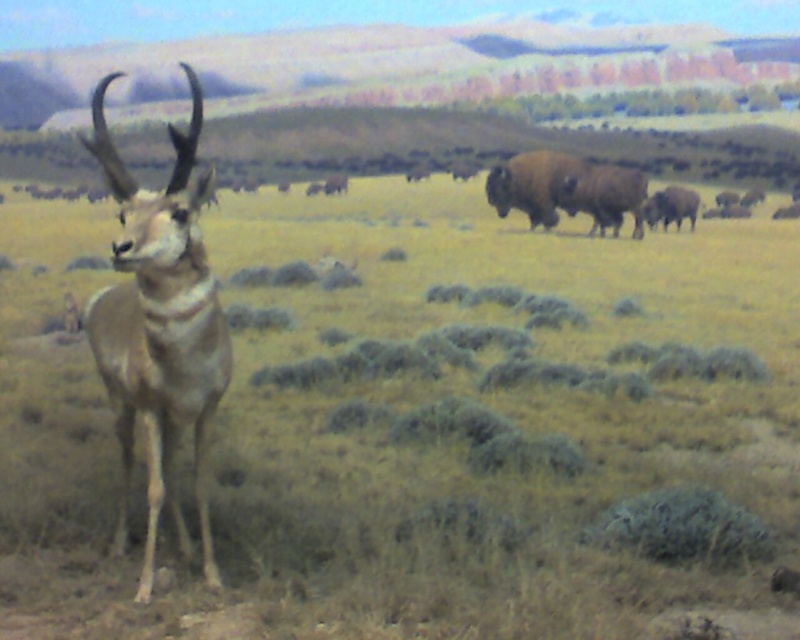
You are a photographer aiming to capture a clear shot of both the green grassy at center and the brown furry yak at right. Based on their positions, which one should you focus on first to ensure both are in focus?

You should focus on the green grassy at center first because it is closer to the viewer than the brown furry yak at right, allowing the yak to stay in focus as well when using a proper aperture.

You are a photographer trying to capture both the light brown fur antelope at left and the brown furry yak at right in a single frame. Based on their positions, which animal would appear closer to the camera in the photo?

The light brown fur antelope at left is located above the brown furry yak at right, so it would appear closer to the camera in the photo.